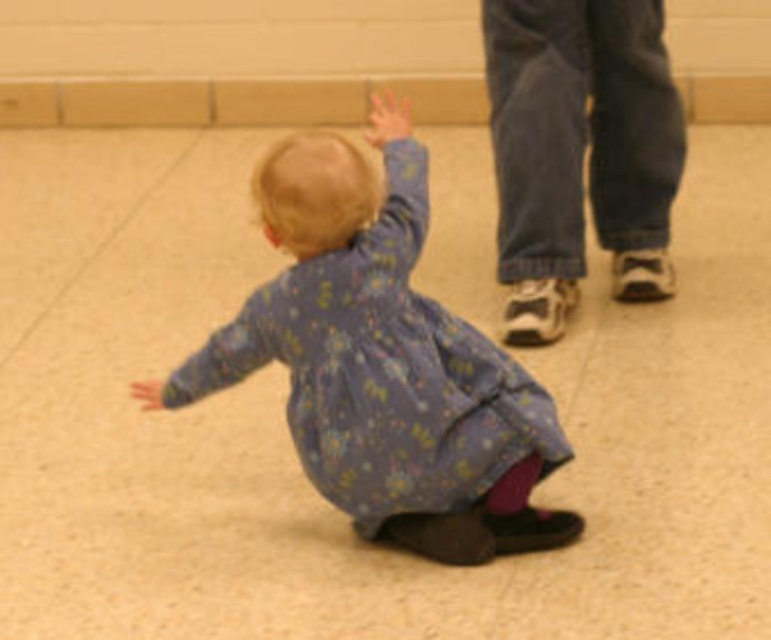
Based on the photo, you are a robot trying to navigate the room. You see two points marked in the image. The first point is at coordinate point (534, 458) and the second is at point (389, 99). Which point is closer to the child crawling on the floor?

Point (534, 458) is in front of point (389, 99), so it is closer to the child crawling on the floor.